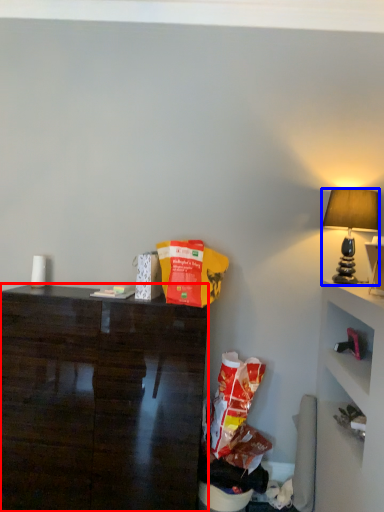
Question: Which of the following is the farthest to the observer, desk (highlighted by a red box) or lamp (highlighted by a blue box)?

Choices:
 (A) desk
 (B) lamp

Answer: (B)